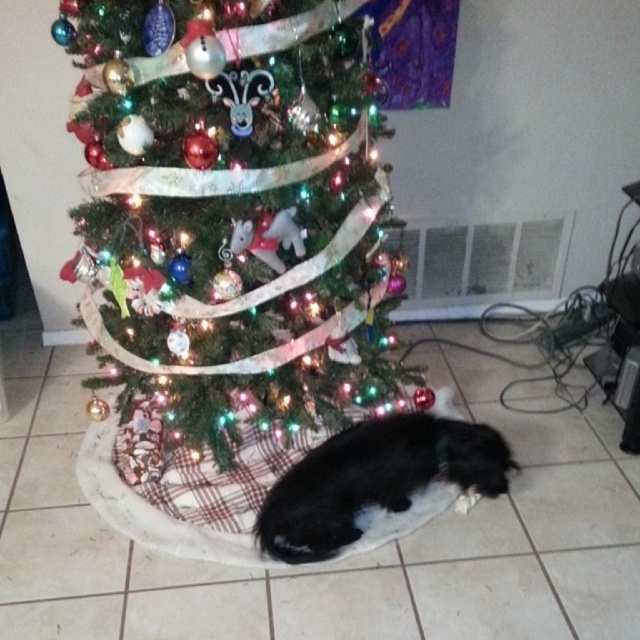
Question: Is shiny green christmas tree at center further to camera compared to black fur dog at lower center?

Choices:
 (A) no
 (B) yes

Answer: (A)

Question: Does shiny green christmas tree at center come behind black fur dog at lower center?

Choices:
 (A) no
 (B) yes

Answer: (A)

Question: Is shiny green christmas tree at center below black fur dog at lower center?

Choices:
 (A) yes
 (B) no

Answer: (B)

Question: Among these objects, which one is nearest to the camera?

Choices:
 (A) black fur dog at lower center
 (B) shiny green christmas tree at center

Answer: (B)